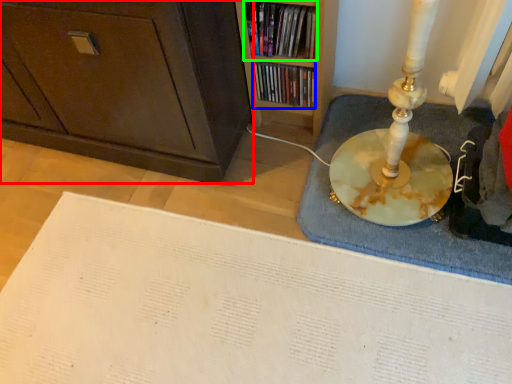
Question: Which is nearer to the cabinetry (highlighted by a red box)? book (highlighted by a blue box) or book (highlighted by a green box).

Choices:
 (A) book
 (B) book

Answer: (B)